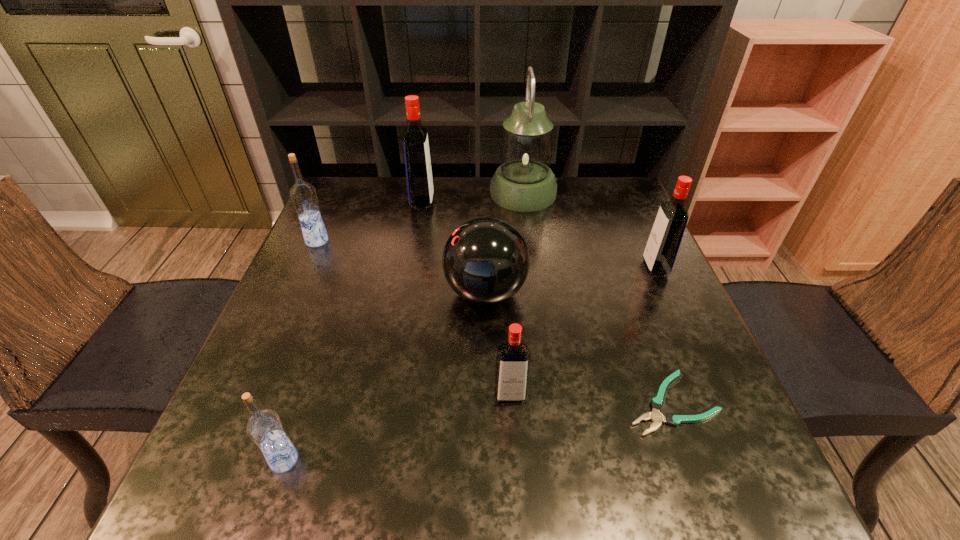
This screenshot has width=960, height=540. Find the location of `pliers at the right edge`. pliers at the right edge is located at coordinates (657, 403).

Identify the location of object that is at the near left corner. (264, 427).

The width and height of the screenshot is (960, 540). What are the coordinates of `free location at the far edge of the desktop` in the screenshot? It's located at (433, 183).

Find the location of a particular element. free space at the near edge is located at coordinates (459, 479).

This screenshot has height=540, width=960. Find the location of `vacant space at the left edge of the desktop`. vacant space at the left edge of the desktop is located at coordinates (308, 390).

Image resolution: width=960 pixels, height=540 pixels. Find the location of `vacant region at the right edge`. vacant region at the right edge is located at coordinates (674, 402).

At what (x,y) coordinates should I click in order to perform the action: click on free space between the nearest red vodka and the shortest object. Please return your answer as a coordinate pair (x, y). Looking at the image, I should click on (590, 399).

I want to click on free spot between the fourth vodka from left to right and the black bowling ball, so click(x=498, y=344).

Locate an element on the screen. The height and width of the screenshot is (540, 960). vacant space that's between the black bowling ball and the leftmost object is located at coordinates (401, 267).

The width and height of the screenshot is (960, 540). What are the coordinates of `empty space between the farthest red vodka and the leftmost vodka` in the screenshot? It's located at (370, 222).